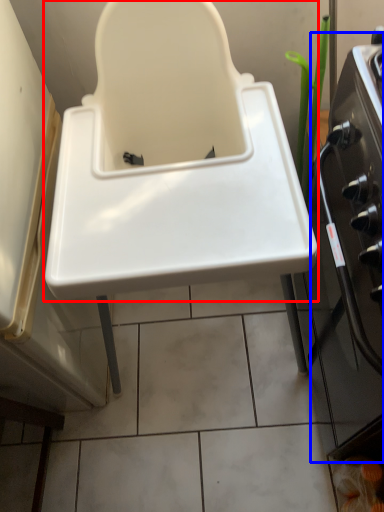
Question: Among these objects, which one is farthest to the camera, sink (highlighted by a red box) or oven (highlighted by a blue box)?

Choices:
 (A) sink
 (B) oven

Answer: (B)